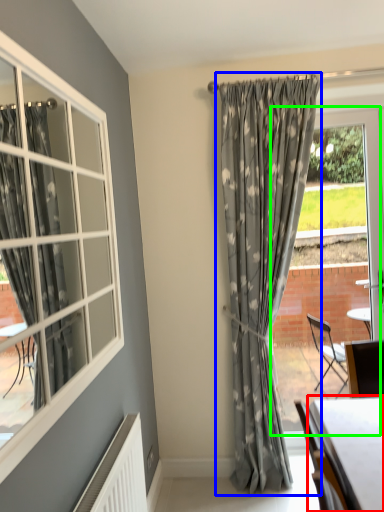
Question: Which object is the farthest from table (highlighted by a red box)? Choose among these: curtain (highlighted by a blue box) or window frame (highlighted by a green box).

Choices:
 (A) curtain
 (B) window frame

Answer: (B)